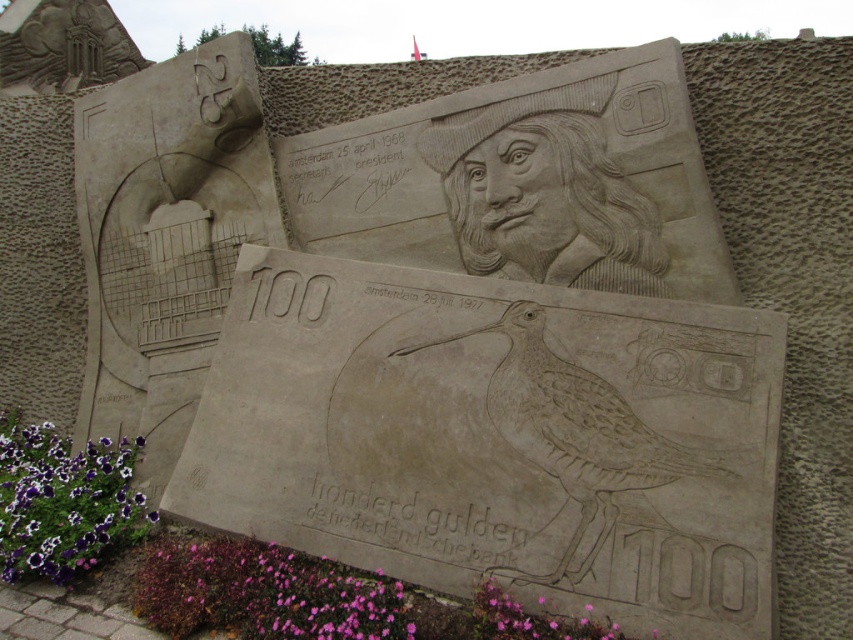
Question: Can you confirm if purple matte flower at lower center is positioned to the right of purple petal at lower left?

Choices:
 (A) yes
 (B) no

Answer: (A)

Question: Which point is closer to the camera taking this photo?

Choices:
 (A) (210, 620)
 (B) (25, 435)
 (C) (476, 608)

Answer: (C)

Question: Observing the image, what is the correct spatial positioning of purple matte flower at lower center in reference to purple petal at lower left?

Choices:
 (A) right
 (B) left

Answer: (A)

Question: Which point is closer to the camera?

Choices:
 (A) (67, 518)
 (B) (337, 572)

Answer: (B)

Question: Can you confirm if purple matte flower at lower center is thinner than purple petal at lower left?

Choices:
 (A) no
 (B) yes

Answer: (B)

Question: Among these objects, which one is nearest to the camera?

Choices:
 (A) pink matte flower at lower center
 (B) purple petal at lower left

Answer: (A)